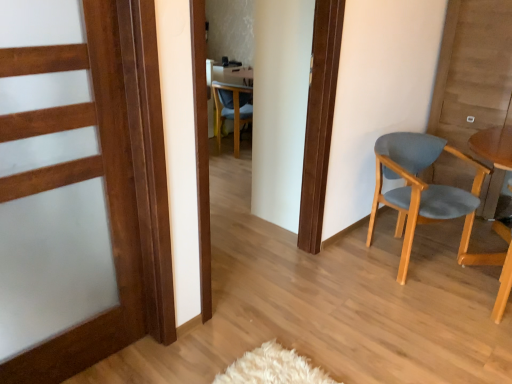
Question: Is blue fabric chair at center, which ranks as the first chair in left-to-right order, oriented towards light blue fabric chair at right, the 1th chair positioned from the bottom?

Choices:
 (A) yes
 (B) no

Answer: (B)

Question: Considering the relative positions of blue fabric chair at center, the 1th chair positioned from the back, and light blue fabric chair at right, placed as the second chair when sorted from left to right, in the image provided, is blue fabric chair at center, the 1th chair positioned from the back, to the left of light blue fabric chair at right, placed as the second chair when sorted from left to right, from the viewer's perspective?

Choices:
 (A) yes
 (B) no

Answer: (A)

Question: Is blue fabric chair at center, placed as the second chair when sorted from right to left, bigger than light blue fabric chair at right, the 1th chair positioned from the bottom?

Choices:
 (A) no
 (B) yes

Answer: (A)

Question: From a real-world perspective, is blue fabric chair at center, which is counted as the second chair, starting from the front, on top of light blue fabric chair at right, which ranks as the second chair in back-to-front order?

Choices:
 (A) no
 (B) yes

Answer: (A)

Question: Considering the relative sizes of blue fabric chair at center, the 1th chair in the top-to-bottom sequence, and light blue fabric chair at right, which ranks as the second chair in back-to-front order, in the image provided, is blue fabric chair at center, the 1th chair in the top-to-bottom sequence, shorter than light blue fabric chair at right, which ranks as the second chair in back-to-front order,?

Choices:
 (A) no
 (B) yes

Answer: (B)

Question: From a real-world perspective, is blue fabric chair at center, the second chair from the bottom, beneath light blue fabric chair at right, the 1th chair positioned from the bottom?

Choices:
 (A) no
 (B) yes

Answer: (B)

Question: From a real-world perspective, is wooden door at left beneath blue fabric chair at center, which ranks as the first chair in left-to-right order?

Choices:
 (A) no
 (B) yes

Answer: (A)

Question: Is wooden door at left bigger than blue fabric chair at center, which is counted as the second chair, starting from the front?

Choices:
 (A) no
 (B) yes

Answer: (A)

Question: Considering the relative positions of wooden door at left and blue fabric chair at center, the second chair from the bottom, in the image provided, is wooden door at left in front of blue fabric chair at center, the second chair from the bottom,?

Choices:
 (A) no
 (B) yes

Answer: (B)

Question: Would you consider wooden door at left to be distant from blue fabric chair at center, the 1th chair positioned from the back?

Choices:
 (A) yes
 (B) no

Answer: (A)

Question: From the image's perspective, would you say wooden door at left is positioned over blue fabric chair at center, placed as the second chair when sorted from right to left?

Choices:
 (A) no
 (B) yes

Answer: (A)

Question: Is wooden door at left next to blue fabric chair at center, which ranks as the first chair in left-to-right order, and touching it?

Choices:
 (A) yes
 (B) no

Answer: (B)

Question: Is wooden door at left bigger than light blue fabric chair at right, the 1th chair positioned from the bottom?

Choices:
 (A) yes
 (B) no

Answer: (B)